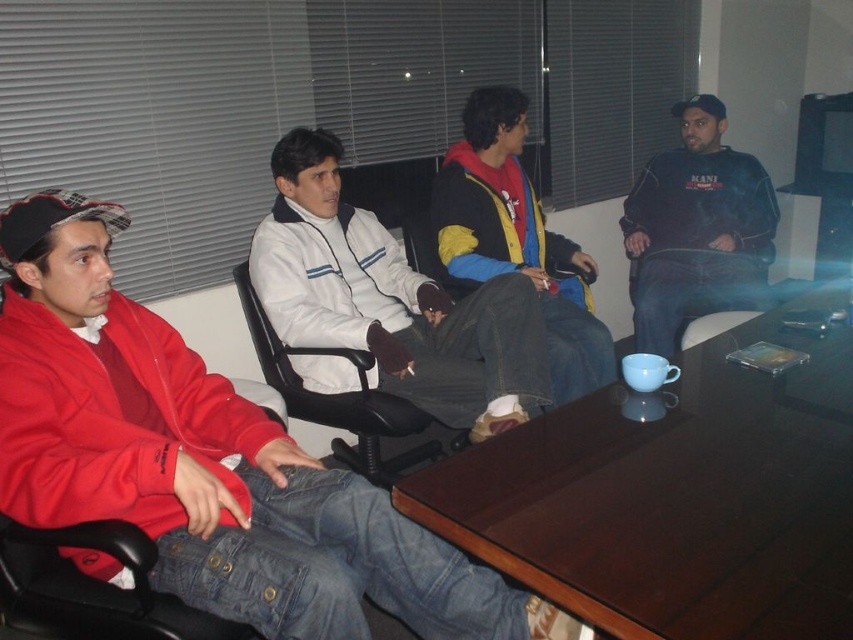
You are standing in the conference room and want to sit down at the brown wooden table at center. However, there is a black leather swivel chair at center in your way. Can you walk around the chair to reach the table?

The brown wooden table at center is above the black leather swivel chair at center, meaning the table is positioned over the chair. Since the table is directly above the chair, you can simply walk around the chair to reach the table as they are likely part of the same furniture set and the chair is positioned under the table.

You are sitting at the back of the conference room and want to hand a document to the person wearing the white fleece jacket at center and the dark blue fleece at right. Which person is closer to you so you can reach them first?

The white fleece jacket at center is closer to the viewer, so you can reach them first.

You are an interior designer assessing the seating arrangement. The dark blue fleece at right and the multicolored fleece jacket at center are two key elements in the scene. Which of these two items is taller?

The multicolored fleece jacket at center is taller than the dark blue fleece at right.